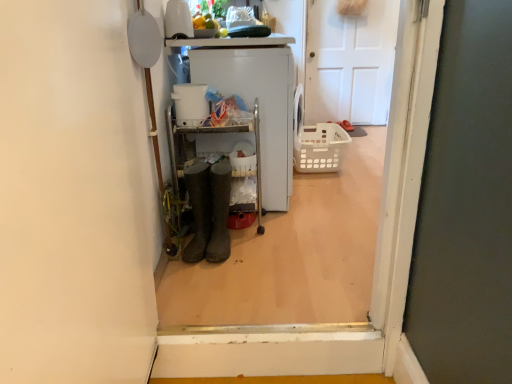
The width and height of the screenshot is (512, 384). I want to click on free area behind brown rubber boots at center, arranged as the 1th footwear when viewed from the right, so [246, 234].